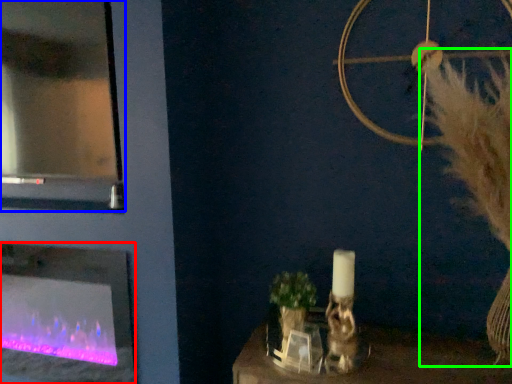
Question: Which object is the farthest from fireplace (highlighted by a red box)? Choose among these: glass door (highlighted by a blue box) or fur (highlighted by a green box).

Choices:
 (A) glass door
 (B) fur

Answer: (B)